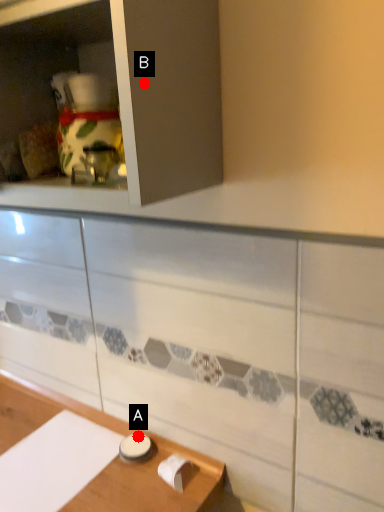
Question: Two points are circled on the image, labeled by A and B beside each circle. Which point is further to the camera?

Choices:
 (A) A is further
 (B) B is further

Answer: (A)